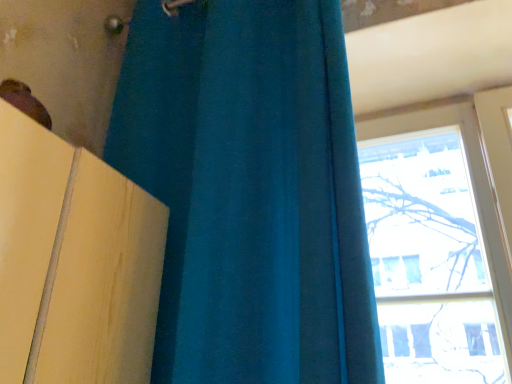
What is the approximate height of teal velvet curtain at center?

teal velvet curtain at center is 1.12 meters in height.

Describe the element at coordinates (250, 191) in the screenshot. I see `teal velvet curtain at center` at that location.

Identify the location of teal velvet curtain at center. The width and height of the screenshot is (512, 384). (250, 191).

Find the location of `teal velvet curtain at center`. teal velvet curtain at center is located at coordinates (250, 191).